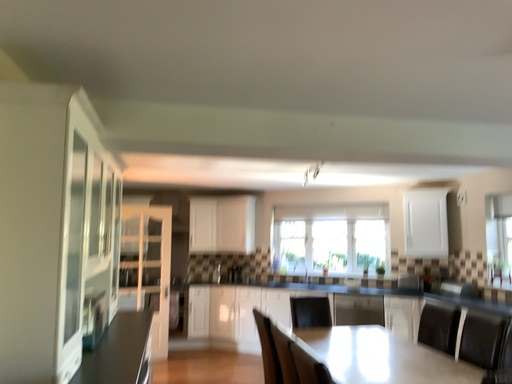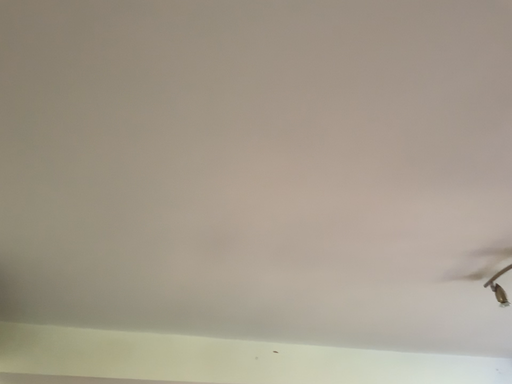
Question: Which way did the camera rotate in the video?

Choices:
 (A) rotated upward
 (B) rotated downward

Answer: (A)